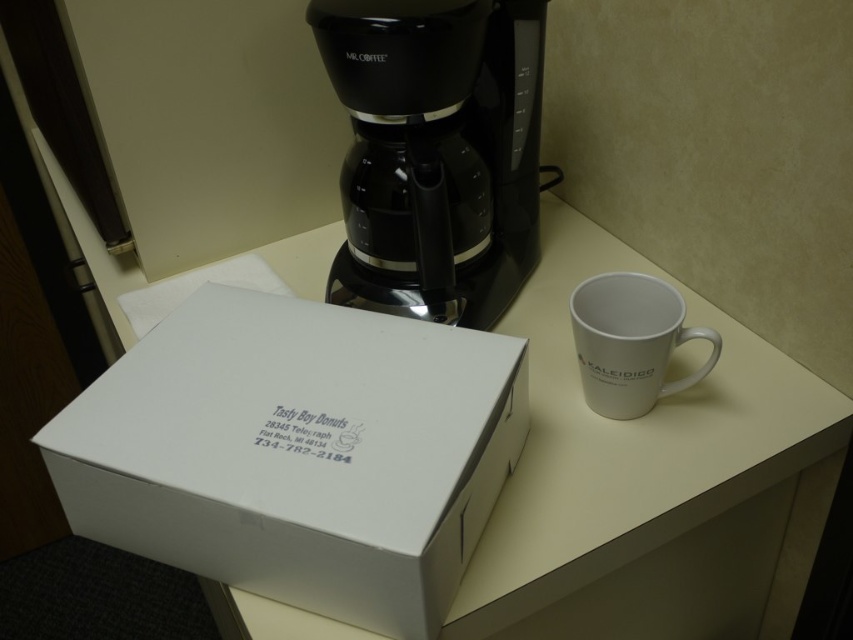
Question: Which point is closer to the camera?

Choices:
 (A) white cardboard box at center
 (B) white matte table at center
 (C) white ceramic mug at right

Answer: (A)

Question: Among these objects, which one is farthest from the camera?

Choices:
 (A) white cardboard box at center
 (B) black plastic coffee maker at center
 (C) white ceramic mug at right
 (D) white matte table at center

Answer: (C)

Question: Which of the following is the farthest from the observer?

Choices:
 (A) black plastic coffee maker at center
 (B) white matte table at center
 (C) white ceramic mug at right
 (D) white cardboard box at center

Answer: (C)

Question: Does white matte table at center appear over white ceramic mug at right?

Choices:
 (A) yes
 (B) no

Answer: (B)

Question: Can you confirm if white cardboard box at center is smaller than white ceramic mug at right?

Choices:
 (A) no
 (B) yes

Answer: (A)

Question: Does black plastic coffee maker at center appear over white ceramic mug at right?

Choices:
 (A) yes
 (B) no

Answer: (A)